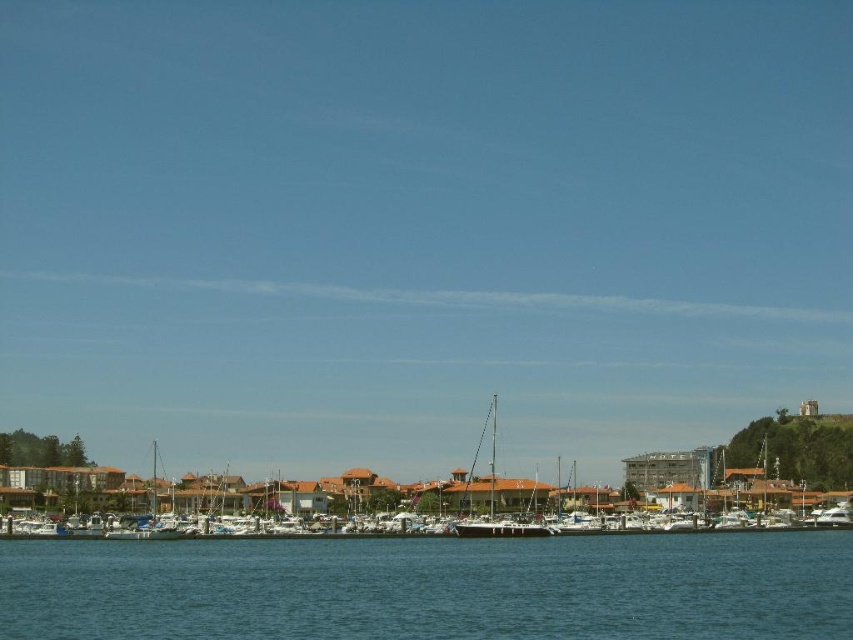
Can you confirm if white matte boats at center is positioned below white glossy sailboat at center?

Yes, white matte boats at center is below white glossy sailboat at center.

Does point (457, 474) lie in front of point (466, 536)?

No, (457, 474) is further to viewer.

Between point (413, 486) and point (514, 531), which one is positioned behind?

Point (413, 486)

The width and height of the screenshot is (853, 640). I want to click on white matte boats at center, so click(x=409, y=492).

Between clear blue water at lower center and white glossy sailboat at center, which one is positioned lower?

white glossy sailboat at center is lower down.

Is point (750, 554) positioned behind point (543, 529)?

No, (750, 554) is closer to viewer.

Measure the distance between clear blue water at lower center and camera.

64.10 meters

Find the location of a particular element. Image resolution: width=853 pixels, height=640 pixels. clear blue water at lower center is located at coordinates (432, 588).

Which is behind, point (844, 634) or point (271, 492)?

Point (271, 492)

Who is more distant from viewer, [474,540] or [97,468]?

The point [97,468] is behind.

Where is `clear blue water at lower center`? The height and width of the screenshot is (640, 853). clear blue water at lower center is located at coordinates (432, 588).